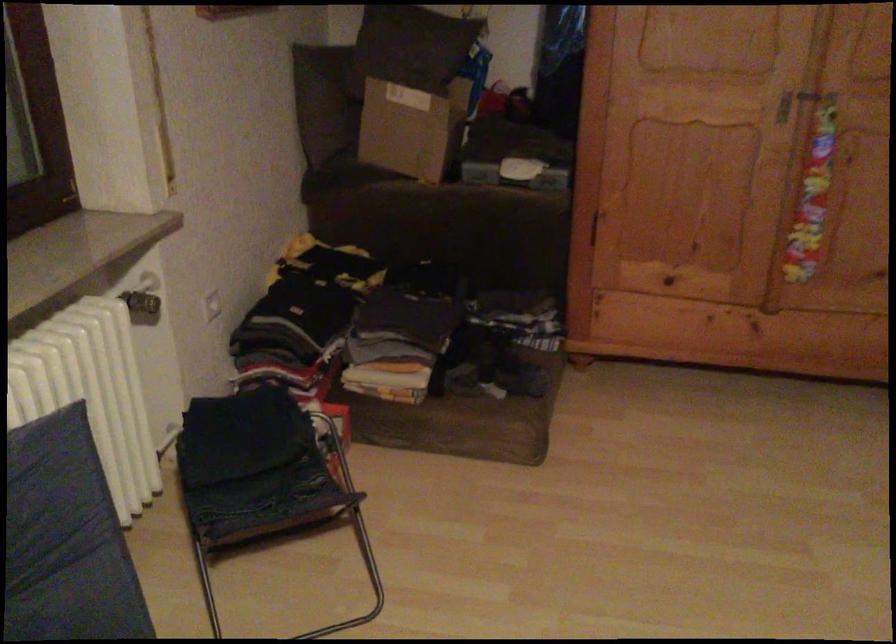
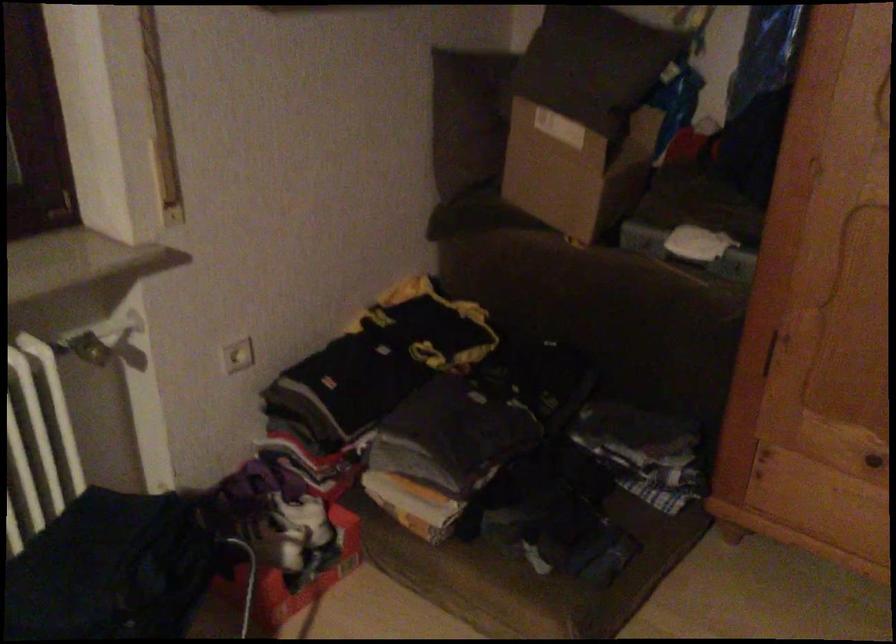
Question: Based on the continuous images, in which direction is the camera rotating? Reply with the corresponding letter.

Choices:
 (A) Left
 (B) Right
 (C) Up
 (D) Down

Answer: (A)